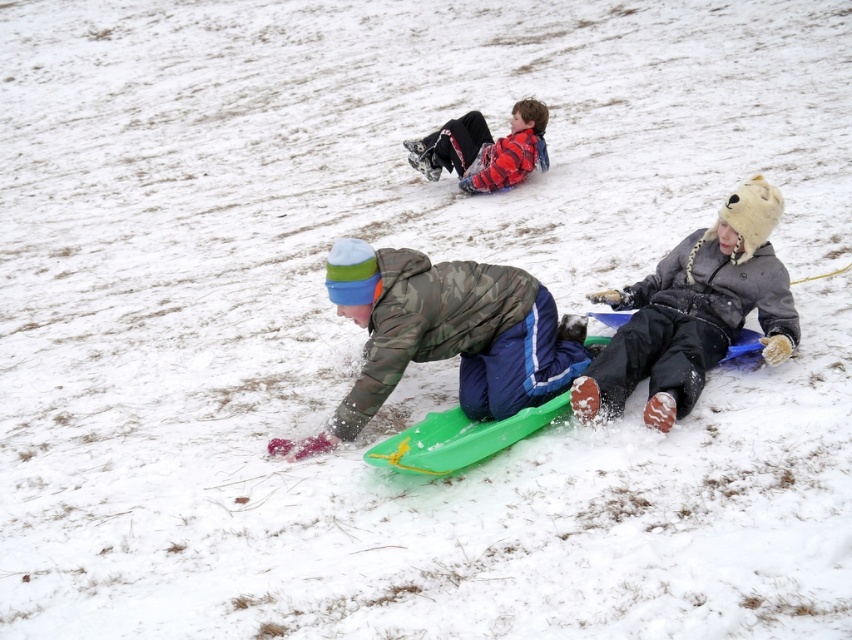
The image size is (852, 640). I want to click on green matte sled at center, so click(446, 333).

What do you see at coordinates (446, 333) in the screenshot?
I see `green matte sled at center` at bounding box center [446, 333].

Is point (412, 356) farther from viewer compared to point (694, 380)?

Yes, it is.

Locate an element on the screen. This screenshot has height=640, width=852. green matte sled at center is located at coordinates (446, 333).

Who is more distant from viewer, [481,364] or [539,164]?

Positioned behind is point [539,164].

Between green matte sled at center and red plaid shirt at center, which one has more height?

green matte sled at center is taller.

Is point (488, 392) less distant than point (445, 138)?

Yes, point (488, 392) is in front of point (445, 138).

You are a GUI agent. You are given a task and a screenshot of the screen. Output one action in this format:
    pyautogui.click(x=<x>, y=<y>)
    Task: Click on the green matte sled at center
    This screenshot has width=852, height=640.
    Given the screenshot: What is the action you would take?
    pyautogui.click(x=446, y=333)

Between point (720, 225) and point (531, 100), which one is positioned behind?

Positioned behind is point (531, 100).

Is point (646, 404) positioned behind point (488, 154)?

No.

Identify the location of gray fuzzy coat at lower right. The image size is (852, 640). (694, 312).